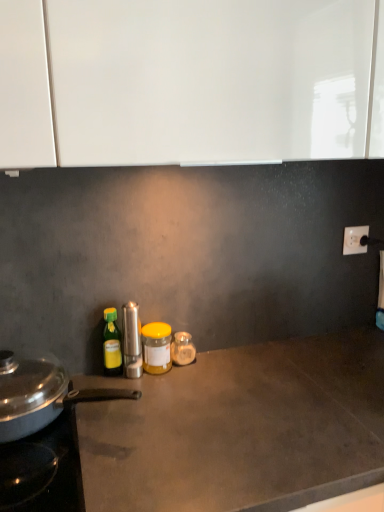
Where is `vacant space in front of translucent glass jar at center, marked as the first bottle in a right-to-left arrangement`? The image size is (384, 512). vacant space in front of translucent glass jar at center, marked as the first bottle in a right-to-left arrangement is located at coordinates (184, 393).